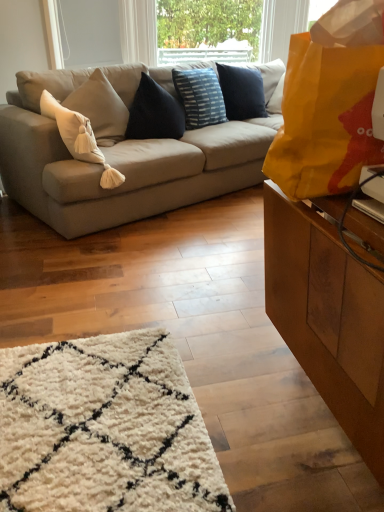
The image size is (384, 512). Find the location of `free space in front of beige fabric couch at center`. free space in front of beige fabric couch at center is located at coordinates (152, 272).